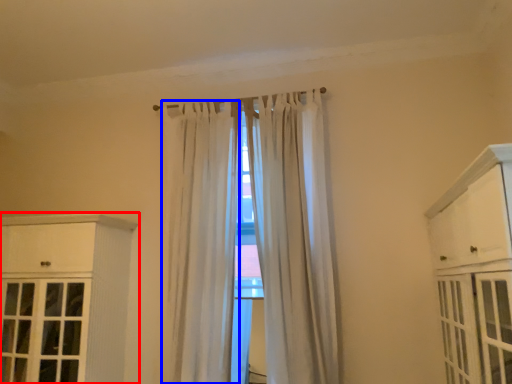
Question: Which object appears farthest to the camera in this image, cabinetry (highlighted by a red box) or curtain (highlighted by a blue box)?

Choices:
 (A) cabinetry
 (B) curtain

Answer: (B)